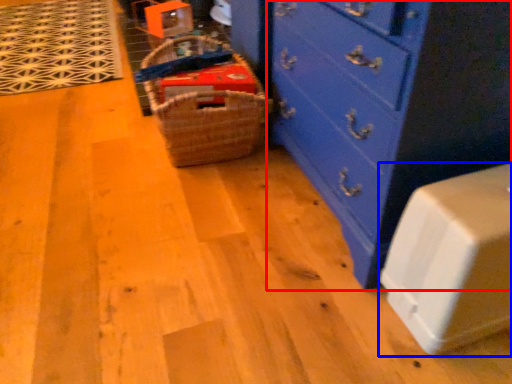
Question: Which point is further to the camera, chest of drawers (highlighted by a red box) or cabinetry (highlighted by a blue box)?

Choices:
 (A) chest of drawers
 (B) cabinetry

Answer: (A)